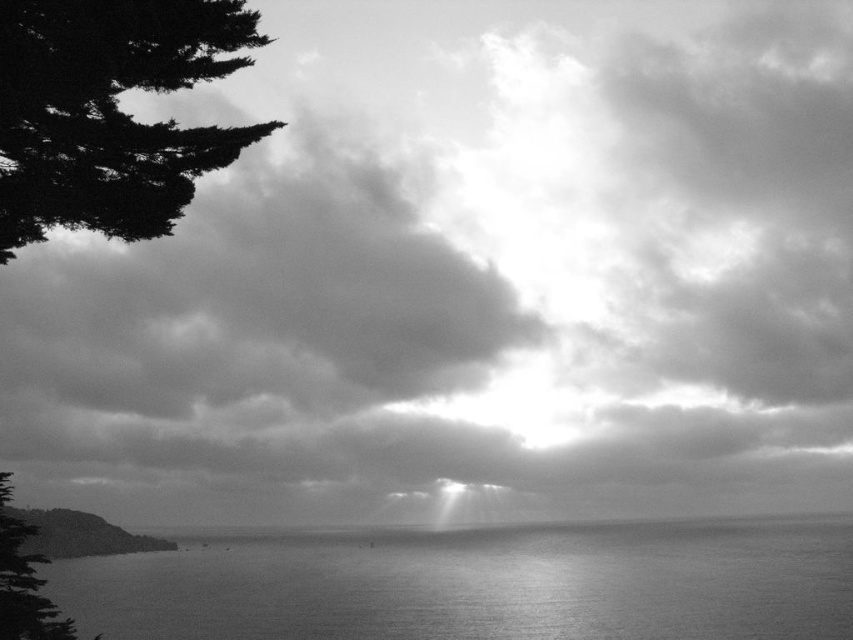
You are a photographer planning to capture the reflection of the dark green textured tree at upper left in the smooth water at center. Based on the scene description, will the reflection of the tree be fully visible in the water?

The smooth water at center is bigger than dark green textured tree at upper left, so the reflection of the dark green textured tree at upper left will be fully visible in the smooth water at center.

You are a photographer standing at the edge of the coast, looking at the smooth water at center and the dark green textured tree at upper left. Which object is closer to the horizon line?

The smooth water at center is positioned under the dark green textured tree at upper left, meaning it is closer to the horizon line than the tree.

You are an artist trying to sketch this coastal scene. You want to place the dark green textured tree at upper left in your drawing. Where should you position it in terms of coordinates?

The dark green textured tree at upper left should be placed at coordinates point (109, 113).